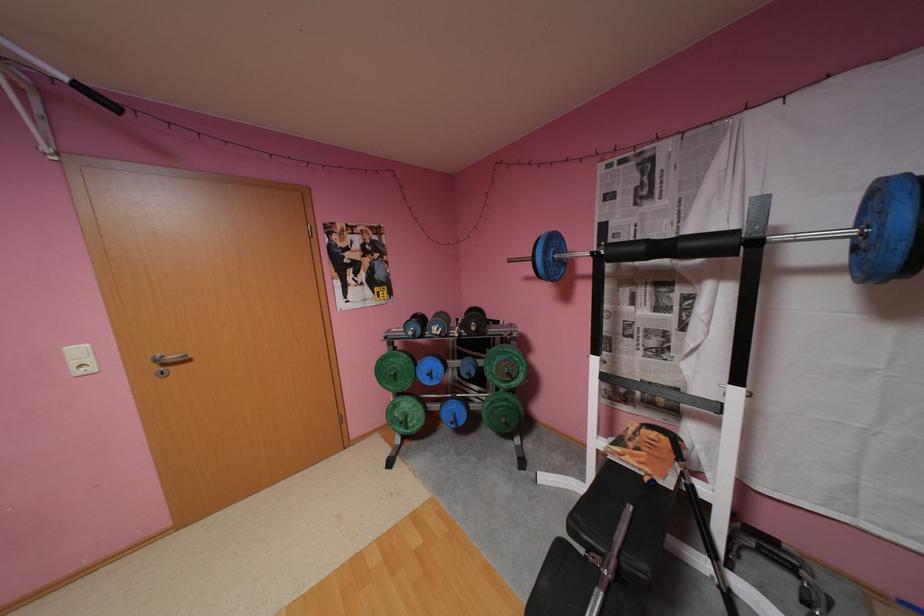
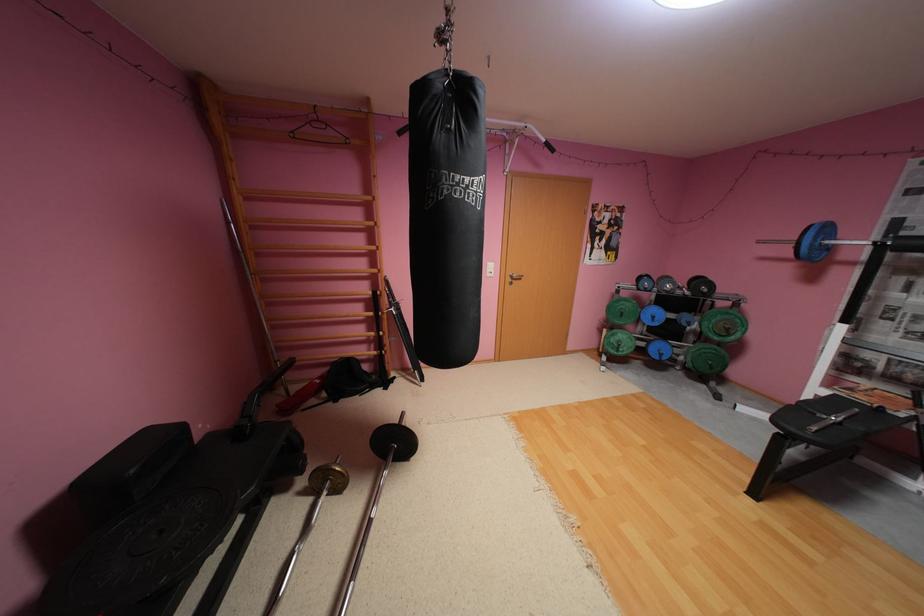
Find the pixel in the second image that matches (x=563, y=241) in the first image.

(835, 229)